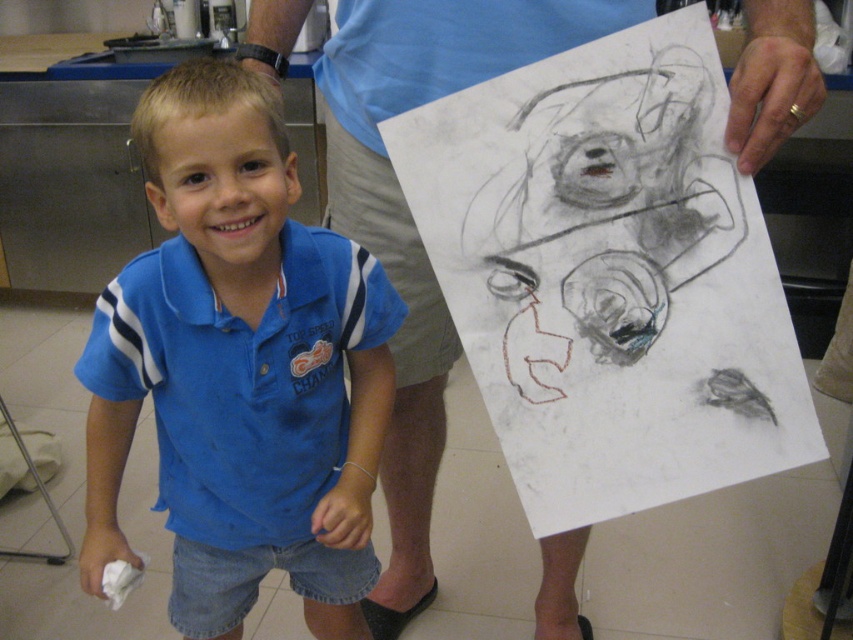
Does charcoal sketch at upper center appear on the right side of blue cotton shirt at upper center?

Yes, charcoal sketch at upper center is to the right of blue cotton shirt at upper center.

Can you confirm if charcoal sketch at upper center is shorter than blue cotton shirt at upper center?

Correct, charcoal sketch at upper center is not as tall as blue cotton shirt at upper center.

Which is behind, point (634, 272) or point (373, 179)?

Point (373, 179)

In order to click on charcoal sketch at upper center in this screenshot , I will do `click(595, 218)`.

This screenshot has height=640, width=853. I want to click on blue cotton shirt at center, so click(x=239, y=369).

Measure the distance from blue cotton shirt at center to charcoal sketch at upper center.

The distance of blue cotton shirt at center from charcoal sketch at upper center is 13.15 inches.

Is point (262, 394) closer to camera compared to point (650, 88)?

No, (262, 394) is further to viewer.

The image size is (853, 640). Find the location of `blue cotton shirt at center`. blue cotton shirt at center is located at coordinates (239, 369).

How much distance is there between blue cotton shirt at center and blue cotton shirt at upper center?

They are 10.99 inches apart.

What do you see at coordinates (239, 369) in the screenshot? This screenshot has height=640, width=853. I see `blue cotton shirt at center` at bounding box center [239, 369].

Measure the distance between point (381, 433) and camera.

3.38 feet

This screenshot has width=853, height=640. What are the coordinates of `blue cotton shirt at center` in the screenshot? It's located at click(x=239, y=369).